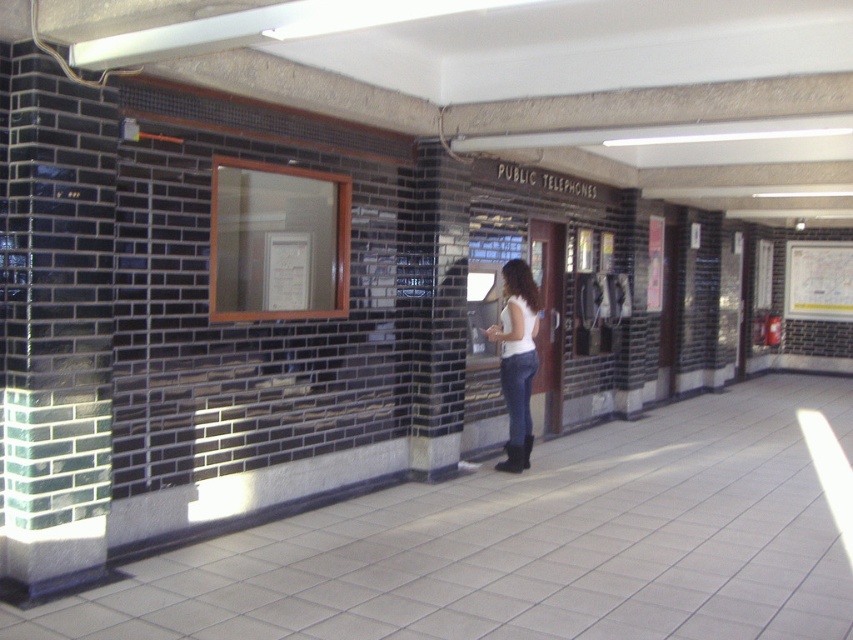
Describe the element at coordinates (54, 321) in the screenshot. I see `green glossy pillar at left` at that location.

Is green glossy pillar at left thinner than white matte shirt at center?

In fact, green glossy pillar at left might be wider than white matte shirt at center.

Is point (53, 106) in front of point (524, 266)?

Yes, point (53, 106) is closer to viewer.

Find the location of a particular element. This screenshot has width=853, height=640. green glossy pillar at left is located at coordinates (54, 321).

Can you confirm if black brick pillar at center is shorter than white matte shirt at center?

No.

Can you confirm if black brick pillar at center is taller than white matte shirt at center?

Yes, black brick pillar at center is taller than white matte shirt at center.

Between point (463, 252) and point (509, 285), which one is positioned behind?

Point (509, 285)

Identify the location of black brick pillar at center. The image size is (853, 640). (438, 308).

Does white matte shirt at center have a lesser width compared to white paper map at upper right?

Yes, white matte shirt at center is thinner than white paper map at upper right.

Between point (502, 332) and point (799, 269), which one is positioned in front?

Point (502, 332)

What are the coordinates of `white matte shirt at center` in the screenshot? It's located at (517, 358).

The image size is (853, 640). I want to click on white matte shirt at center, so click(x=517, y=358).